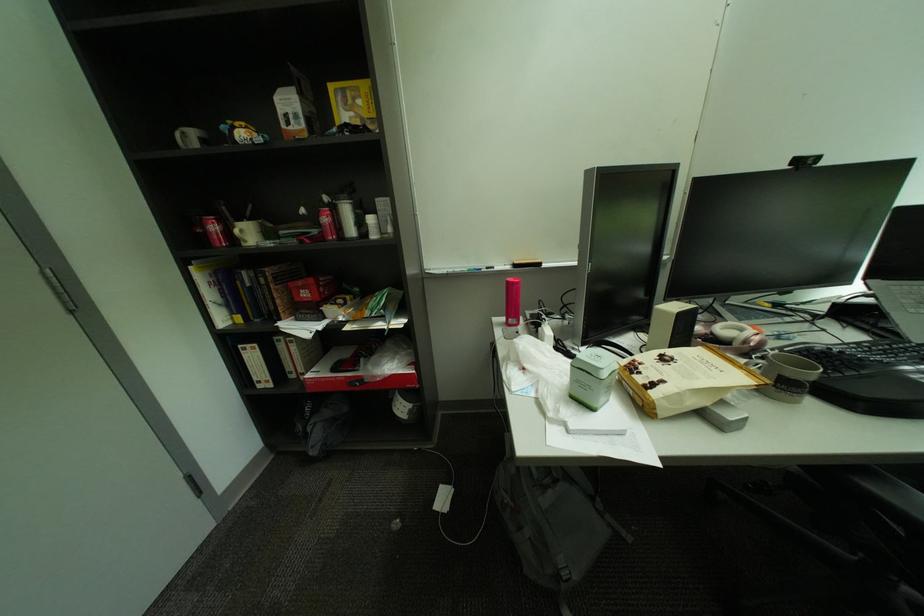
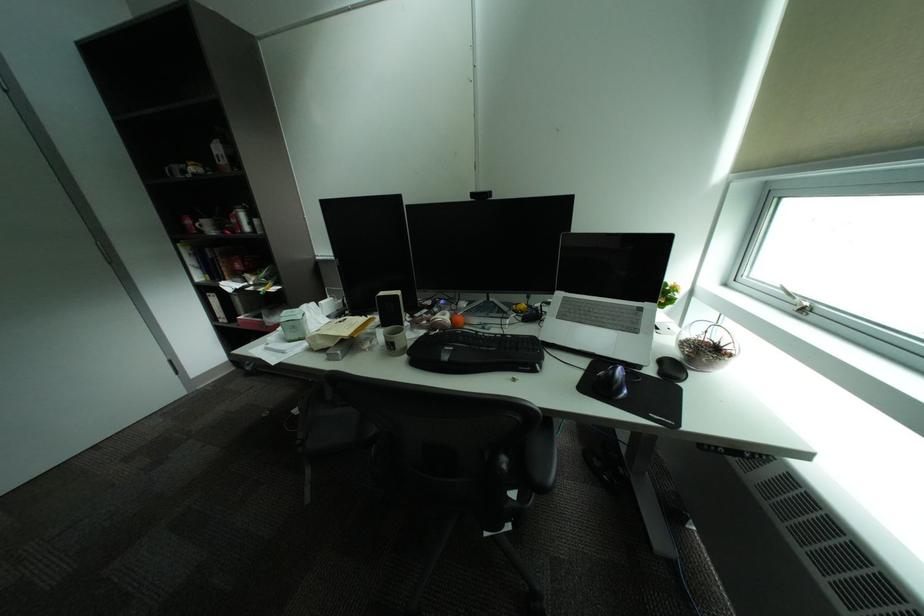
Where in the second image is the point corresponding to pixel 225 229 from the first image?

(199, 223)